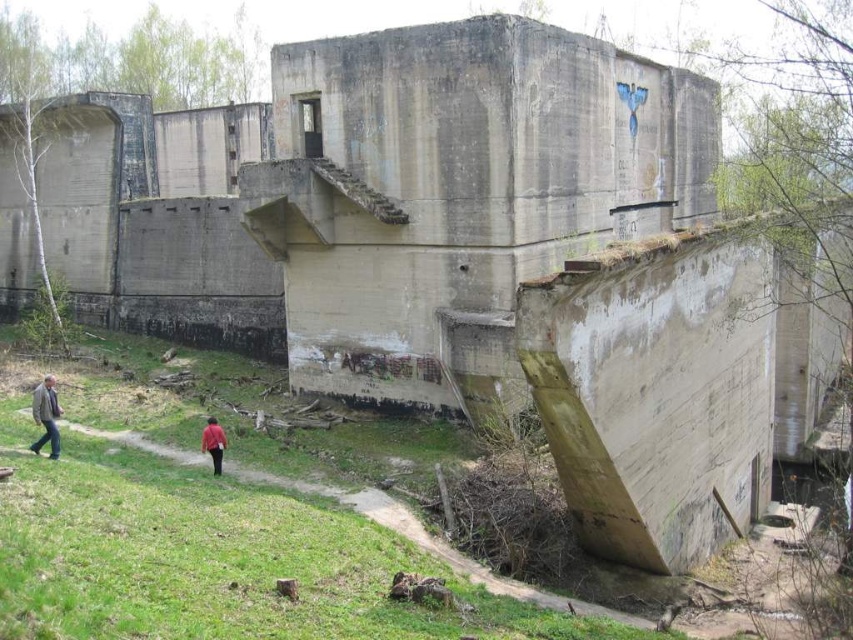
From the picture: You are a hiker who has entered the abandoned bunker and wants to place both the light brown leather jacket at lower left and the red matte shirt at lower center on a small shelf. The shelf can only hold one item. Which item should you choose to fit on the shelf?

The red matte shirt at lower center is smaller in size compared to the light brown leather jacket at lower left, so it will fit better on the small shelf.

You are standing in front of the abandoned concrete structure and want to determine the relative positions of two points marked on the structure. Which point is closer to you, point (33,449) or point (206,438)?

Point (33,449) is closer to the camera than point (206,438), so it is closer to you.

You are exploring the abandoned bunker and see a light brown leather jacket at lower left and a red matte shirt at lower center. Which clothing item is positioned more to the east?

The light brown leather jacket at lower left is positioned more to the east because it is to the left of the red matte shirt at lower center.